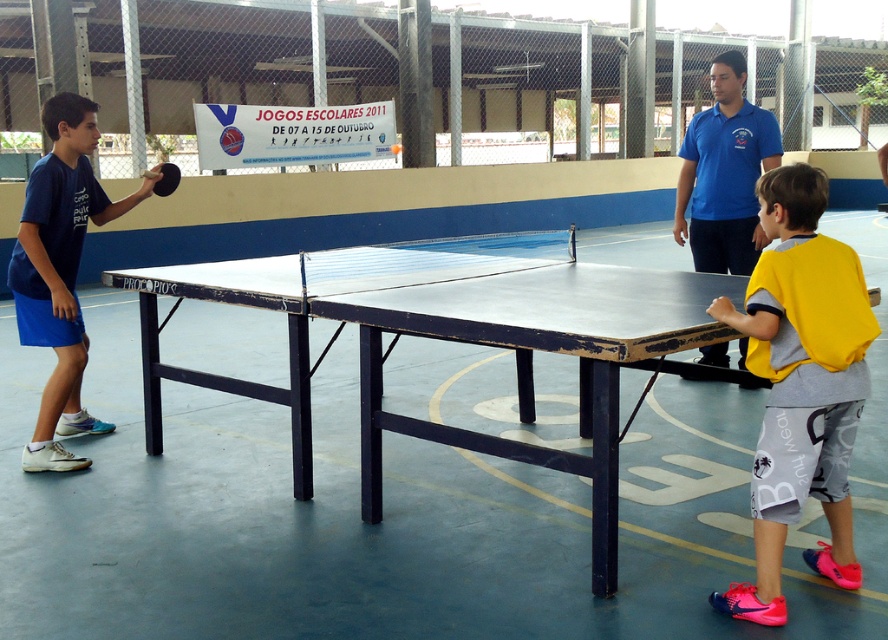
Who is higher up, matte blue shorts at left or blue cotton shirt at center?

blue cotton shirt at center is above.

From the picture: Does matte blue shorts at left have a lesser width compared to blue cotton shirt at center?

No.

Is point (48, 227) farther from camera compared to point (733, 51)?

No, (48, 227) is in front of (733, 51).

I want to click on matte blue shorts at left, so click(x=60, y=273).

Does point (775, 278) come behind point (28, 452)?

No, it is in front of (28, 452).

Can you confirm if yellow jersey at right is smaller than matte blue shorts at left?

Indeed, yellow jersey at right has a smaller size compared to matte blue shorts at left.

The image size is (888, 640). Describe the element at coordinates (799, 385) in the screenshot. I see `yellow jersey at right` at that location.

This screenshot has width=888, height=640. What are the coordinates of `yellow jersey at right` in the screenshot? It's located at (799, 385).

Is point (712, 168) farther from camera compared to point (161, 186)?

Yes, point (712, 168) is farther from viewer.

Between point (695, 122) and point (157, 179), which one is positioned behind?

Positioned behind is point (695, 122).

Where is `blue cotton shirt at center`? The image size is (888, 640). blue cotton shirt at center is located at coordinates (725, 173).

Find the location of a particular element. Image resolution: width=888 pixels, height=640 pixels. blue cotton shirt at center is located at coordinates (725, 173).